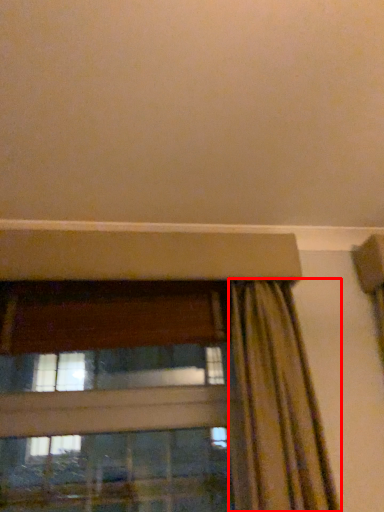
Question: In this image, where is curtain (annotated by the red box) located relative to window?

Choices:
 (A) left
 (B) right

Answer: (B)